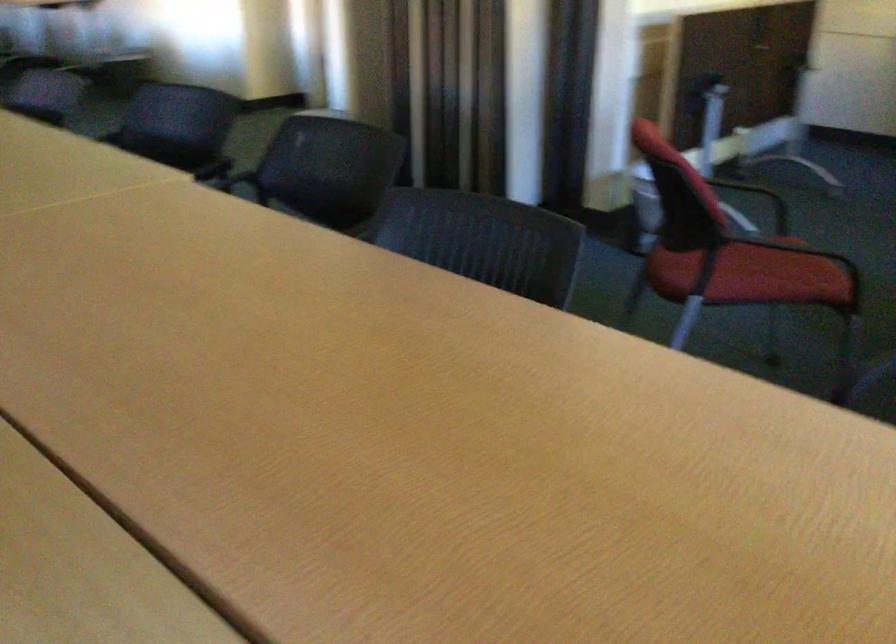
Identify the location of dark chair sitting surface. (114, 134).